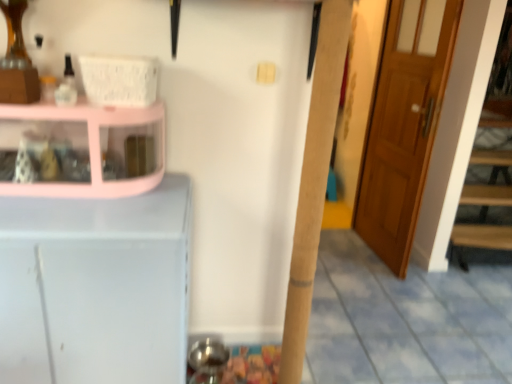
Question: Looking at their shapes, would you say white matte cabinet at left is wider or thinner than pink glossy cabinet at left?

Choices:
 (A) wide
 (B) thin

Answer: (A)

Question: In the image, is white matte cabinet at left positioned in front of or behind pink glossy cabinet at left?

Choices:
 (A) behind
 (B) front

Answer: (B)

Question: Which object is positioned farthest from the pink glossy cabinet at left?

Choices:
 (A) wooden door at right
 (B) white matte cabinet at left

Answer: (A)

Question: Estimate the real-world distances between objects in this image. Which object is closer to the pink glossy cabinet at left?

Choices:
 (A) white matte cabinet at left
 (B) wooden door at right

Answer: (A)